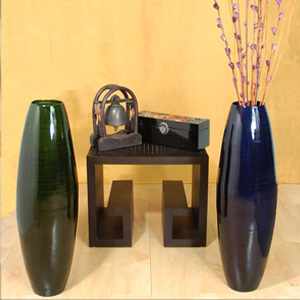
The image size is (300, 300). I want to click on marbled tile floor, so click(x=145, y=247).